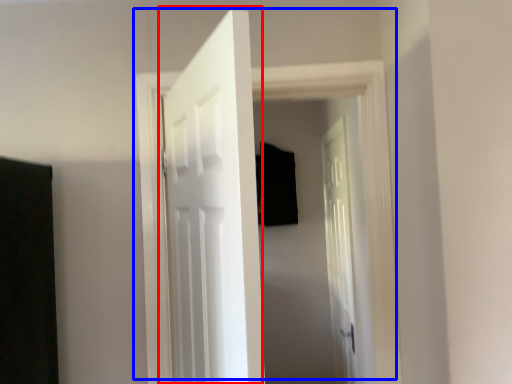
Question: Which point is further to the camera, door (highlighted by a red box) or door (highlighted by a blue box)?

Choices:
 (A) door
 (B) door

Answer: (B)